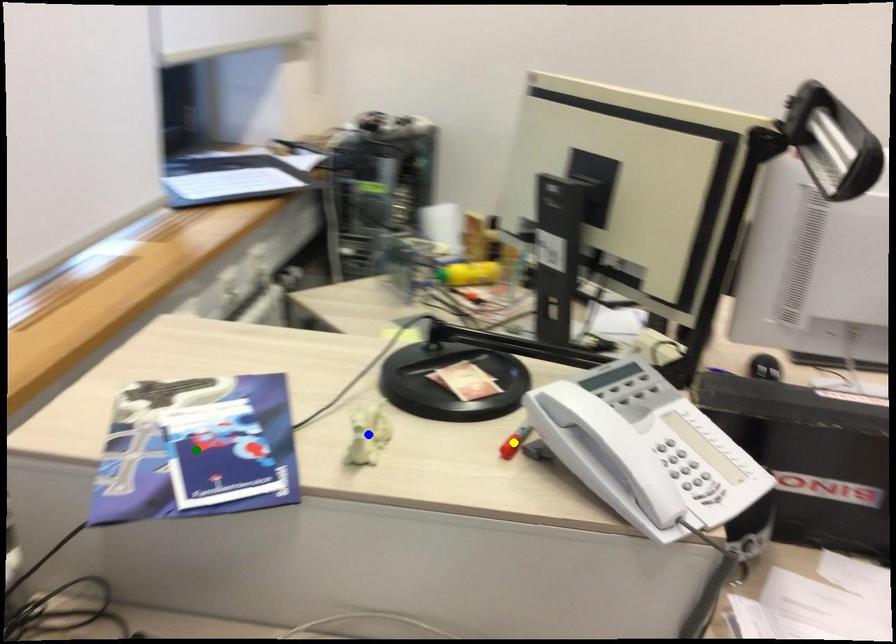
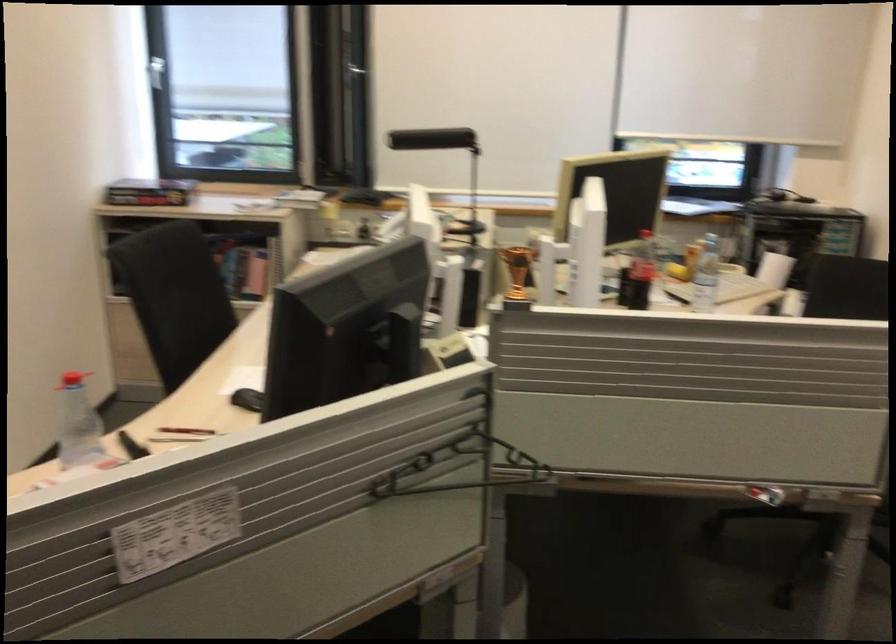
I am providing you with two images of the same scene from different viewpoints. Three points are marked in image1. Which point corresponds to a part or object that is occluded in image2?In image1, three points are marked. Which of them correspond to a part or object that is occluded in image2?Among the three points shown in image1, which one corresponds to a part or object that is no longer visible due to occlusion in image2?

green point, blue point, yellow point